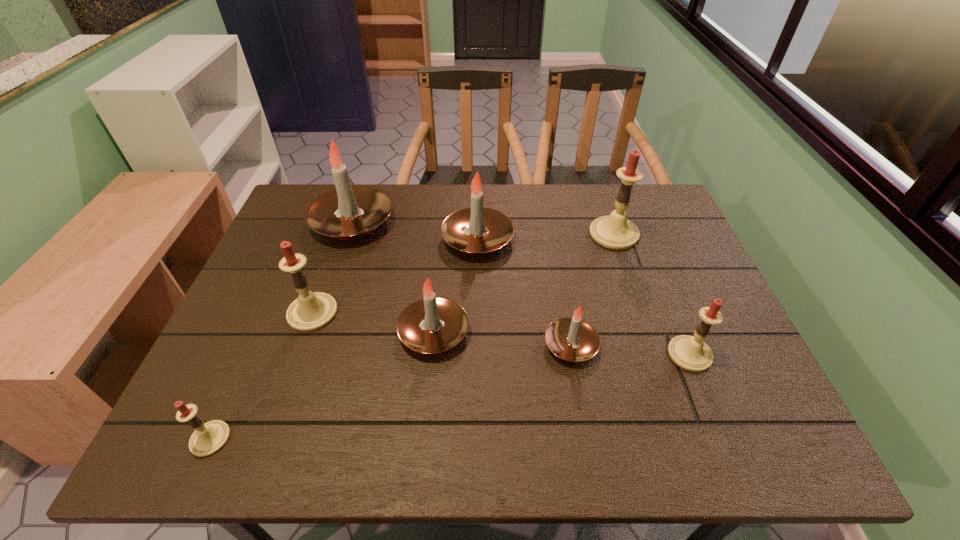
The width and height of the screenshot is (960, 540). Identify the location of vacant point located between the biggest red candle and the third biggest red candle. (652, 294).

Find the location of a particular element. Image resolution: width=960 pixels, height=540 pixels. free space between the biggest white candle and the third object from right to left is located at coordinates (462, 284).

The height and width of the screenshot is (540, 960). I want to click on free space between the nearest red candle and the third nearest red candle, so click(261, 376).

Locate an element on the screen. The image size is (960, 540). free space between the smallest red candle and the second nearest red candle is located at coordinates (450, 396).

At what (x,y) coordinates should I click in order to perform the action: click on free spot between the third red candle from right to left and the third smallest white candle. Please return your answer as a coordinate pair (x, y). The image size is (960, 540). Looking at the image, I should click on (395, 276).

Identify the location of empty space between the biggest red candle and the third smallest white candle. The height and width of the screenshot is (540, 960). (545, 237).

Locate an element on the screen. The width and height of the screenshot is (960, 540). object that stands as the fifth closest to the second biggest white candle is located at coordinates (311, 311).

Locate an element on the screen. The height and width of the screenshot is (540, 960). object that is the sixth closest to the smallest white candle is located at coordinates (311, 311).

Locate an element on the screen. Image resolution: width=960 pixels, height=540 pixels. candle that is the second closest to the smallest red candle is located at coordinates (433, 324).

Identify which candle is located as the fifth nearest to the third smallest white candle. Please provide its 2D coordinates. Your answer should be formatted as a tuple, i.e. [(x, y)], where the tuple contains the x and y coordinates of a point satisfying the conditions above.

[(311, 311)]